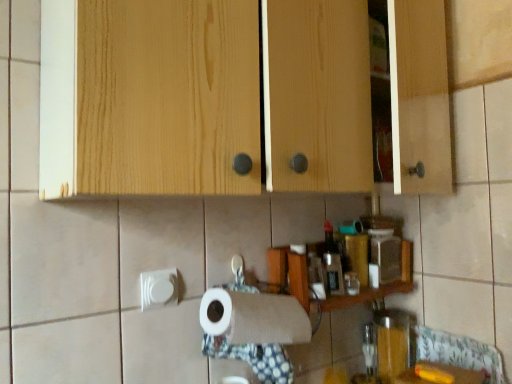
Measure the distance between point (441, 375) and camera.

Point (441, 375) is 3.28 feet away from camera.

Describe the element at coordinates (288, 274) in the screenshot. This screenshot has height=384, width=512. I see `wooden shelf at center` at that location.

This screenshot has width=512, height=384. Identify the location of smooth wooden counter at lower right. (440, 375).

From the image's perspective, between natural wood cabinet at upper center and wooden shelf at center, which one is located above?

natural wood cabinet at upper center appears higher in the image.

Does natural wood cabinet at upper center have a larger size compared to wooden shelf at center?

Indeed, natural wood cabinet at upper center has a larger size compared to wooden shelf at center.

Considering the relative sizes of natural wood cabinet at upper center and wooden shelf at center in the image provided, is natural wood cabinet at upper center shorter than wooden shelf at center?

No.

Is natural wood cabinet at upper center oriented towards wooden shelf at center?

No, natural wood cabinet at upper center is not oriented towards wooden shelf at center.

From the image's perspective, is natural wood cabinet at upper center under smooth wooden counter at lower right?

Incorrect, from the image's perspective, natural wood cabinet at upper center is higher than smooth wooden counter at lower right.

Is natural wood cabinet at upper center taller than smooth wooden counter at lower right?

Indeed, natural wood cabinet at upper center has a greater height compared to smooth wooden counter at lower right.

Relative to smooth wooden counter at lower right, is natural wood cabinet at upper center in front or behind?

Visually, natural wood cabinet at upper center is located in front of smooth wooden counter at lower right.

Is natural wood cabinet at upper center looking in the opposite direction of smooth wooden counter at lower right?

No, natural wood cabinet at upper center is not facing the opposite direction of smooth wooden counter at lower right.

Which object is positioned more to the right, natural wood cabinet at upper center or translucent glass jar at lower right?

From the viewer's perspective, translucent glass jar at lower right appears more on the right side.

From their relative heights in the image, would you say natural wood cabinet at upper center is taller or shorter than translucent glass jar at lower right?

Considering their sizes, natural wood cabinet at upper center has more height than translucent glass jar at lower right.

Are natural wood cabinet at upper center and translucent glass jar at lower right making contact?

natural wood cabinet at upper center and translucent glass jar at lower right are not in contact.

Is translucent glass jar at lower right far from smooth wooden counter at lower right?

translucent glass jar at lower right is actually quite close to smooth wooden counter at lower right.

From a real-world perspective, which is physically below, translucent glass jar at lower right or smooth wooden counter at lower right?

From a 3D spatial view, smooth wooden counter at lower right is below.

Which point is more distant from viewer, (391, 361) or (451, 369)?

The point (391, 361) is farther from the camera.

How many degrees apart are the facing directions of translucent glass jar at lower right and smooth wooden counter at lower right?

They differ by 10.2 degrees in their facing directions.

Considering the positions of objects smooth wooden counter at lower right and wooden shelf at center in the image provided, who is more to the right, smooth wooden counter at lower right or wooden shelf at center?

smooth wooden counter at lower right.

Is smooth wooden counter at lower right not near wooden shelf at center?

No.

What's the angular difference between smooth wooden counter at lower right and wooden shelf at center's facing directions?

10.3 degrees separate the facing orientations of smooth wooden counter at lower right and wooden shelf at center.

Measure the distance between smooth wooden counter at lower right and wooden shelf at center.

smooth wooden counter at lower right is 10.61 inches from wooden shelf at center.

In terms of width, does smooth wooden counter at lower right look wider or thinner when compared to translucent glass jar at lower right?

In the image, smooth wooden counter at lower right appears to be wider than translucent glass jar at lower right.

Considering the positions of objects smooth wooden counter at lower right and translucent glass jar at lower right in the image provided, who is more to the left, smooth wooden counter at lower right or translucent glass jar at lower right?

translucent glass jar at lower right is more to the left.

From a real-world perspective, is smooth wooden counter at lower right physically below translucent glass jar at lower right?

Yes, from a real-world perspective, smooth wooden counter at lower right is beneath translucent glass jar at lower right.

Relative to translucent glass jar at lower right, is smooth wooden counter at lower right in front or behind?

smooth wooden counter at lower right is in front of translucent glass jar at lower right.

Which is in front, point (391, 309) or point (52, 23)?

Positioned in front is point (52, 23).

Could you tell me if translucent glass jar at lower right is facing natural wood cabinet at upper center?

No, translucent glass jar at lower right is not aimed at natural wood cabinet at upper center.

Locate an element on the screen. cabinetry lying on the left of translucent glass jar at lower right is located at coordinates (238, 96).

Does translucent glass jar at lower right lie behind natural wood cabinet at upper center?

Yes, it is.

Where is `cabinetry located above the wooden shelf at center (from a real-world perspective)`? The height and width of the screenshot is (384, 512). cabinetry located above the wooden shelf at center (from a real-world perspective) is located at coordinates (238, 96).

Identify the location of cabinetry that appears on the left of smooth wooden counter at lower right. (238, 96).

Considering their positions, is smooth wooden counter at lower right positioned closer to wooden shelf at center than natural wood cabinet at upper center?

smooth wooden counter at lower right is positioned closer to the anchor wooden shelf at center.

Estimate the real-world distances between objects in this image. Which object is closer to translucent glass jar at lower right, natural wood cabinet at upper center or smooth wooden counter at lower right?

The object closer to translucent glass jar at lower right is smooth wooden counter at lower right.

When comparing their distances from smooth wooden counter at lower right, does natural wood cabinet at upper center or translucent glass jar at lower right seem closer?

translucent glass jar at lower right.

Which object lies nearer to the anchor point wooden shelf at center, translucent glass jar at lower right or smooth wooden counter at lower right?

translucent glass jar at lower right lies closer to wooden shelf at center than the other object.

Considering their positions, is translucent glass jar at lower right positioned further to natural wood cabinet at upper center than wooden shelf at center?

Based on the image, translucent glass jar at lower right appears to be further to natural wood cabinet at upper center.

When comparing their distances from natural wood cabinet at upper center, does wooden shelf at center or translucent glass jar at lower right seem closer?

Among the two, wooden shelf at center is located nearer to natural wood cabinet at upper center.

From the picture: Estimate the real-world distances between objects in this image. Which object is further from smooth wooden counter at lower right, wooden shelf at center or translucent glass jar at lower right?

wooden shelf at center.

Considering their positions, is smooth wooden counter at lower right positioned further to translucent glass jar at lower right than natural wood cabinet at upper center?

natural wood cabinet at upper center is positioned further to the anchor translucent glass jar at lower right.

Where is `appliance between wooden shelf at center and smooth wooden counter at lower right in the vertical direction`? The width and height of the screenshot is (512, 384). appliance between wooden shelf at center and smooth wooden counter at lower right in the vertical direction is located at coordinates (392, 342).

Find the location of a particular element. appliance between natural wood cabinet at upper center and smooth wooden counter at lower right in the up-down direction is located at coordinates tap(392, 342).

The image size is (512, 384). Find the location of `shelf between natural wood cabinet at upper center and translucent glass jar at lower right in the vertical direction`. shelf between natural wood cabinet at upper center and translucent glass jar at lower right in the vertical direction is located at coordinates (288, 274).

The height and width of the screenshot is (384, 512). What are the coordinates of `shelf between natural wood cabinet at upper center and smooth wooden counter at lower right in the vertical direction` in the screenshot? It's located at pos(288,274).